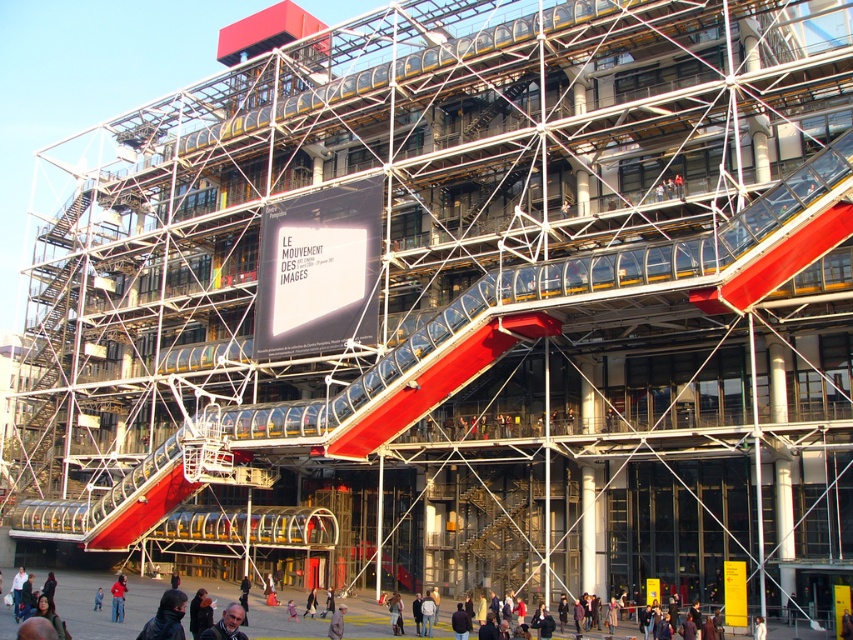
You are standing at the entrance of the Centre Pompidou and want to reach the observation deck located at point (312, 604). Given that the average walking speed is 1.4 meters per second, approximately how many seconds will it take you to walk directly to that point?

The distance between you and point (312, 604) is 59.80 meters. At a walking speed of 1.4 meters per second, it would take approximately 42.7 seconds to reach the point.

You are a visitor standing at the entrance of the Centre Pompidou. You see a light gray fabric jacket at center and a blue denim jacket at center. If you want to place both jackets on a shelf that is 1.5 meters long, will they fit together?

The light gray fabric jacket at center is 11.10 meters from blue denim jacket at center. Since the distance between them is much greater than the shelf length of 1.5 meters, they cannot fit together on the shelf.